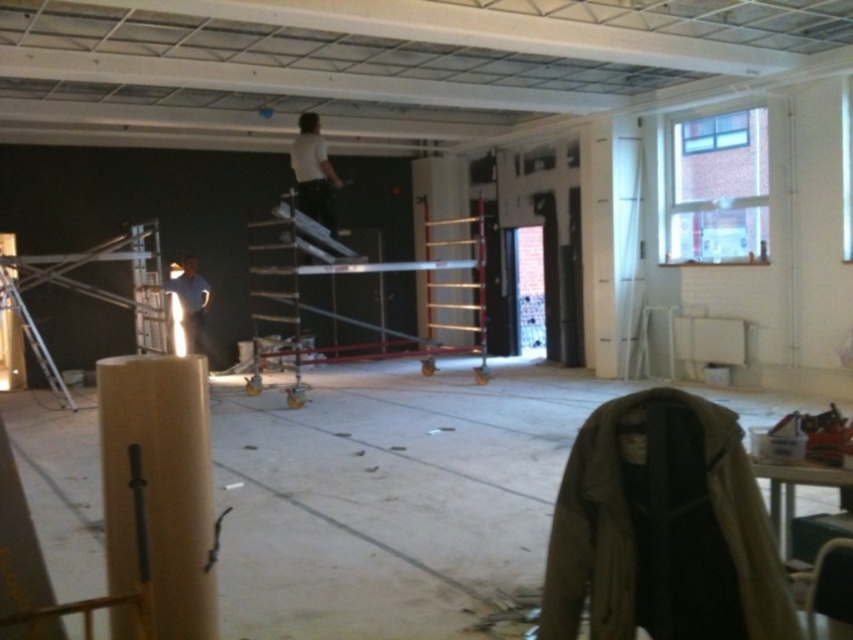
You are an inspector checking the construction site. You see the wooden ladder at center and the blue shirt at lower left. Which object is taller?

The wooden ladder at center is taller than the blue shirt at lower left.

You are a painter who needs to reach the high ceiling tiles to paint them. You have a wooden ladder at center and a white matte shirt at upper center. Can you use the ladder to reach the ceiling tiles without moving the shirt?

The distance between the wooden ladder at center and the white matte shirt at upper center is 17.08 feet. Since the ladder is at the center and the shirt is at upper center, the ladder is positioned far enough from the shirt to safely reach the ceiling tiles without disturbing the shirt.

You are an interior designer standing in the room. You notice the brown cardboard pillar at lower left and the white matte shirt at upper center. Which object is closer to you?

The brown cardboard pillar at lower left is closer to you since it is in front of the white matte shirt at upper center.